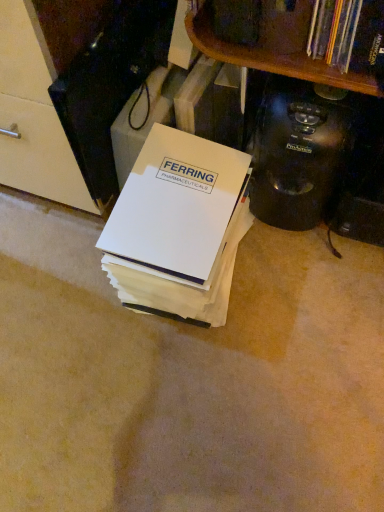
The width and height of the screenshot is (384, 512). In order to click on spots to the right of white paper at center in this screenshot , I will do `click(294, 292)`.